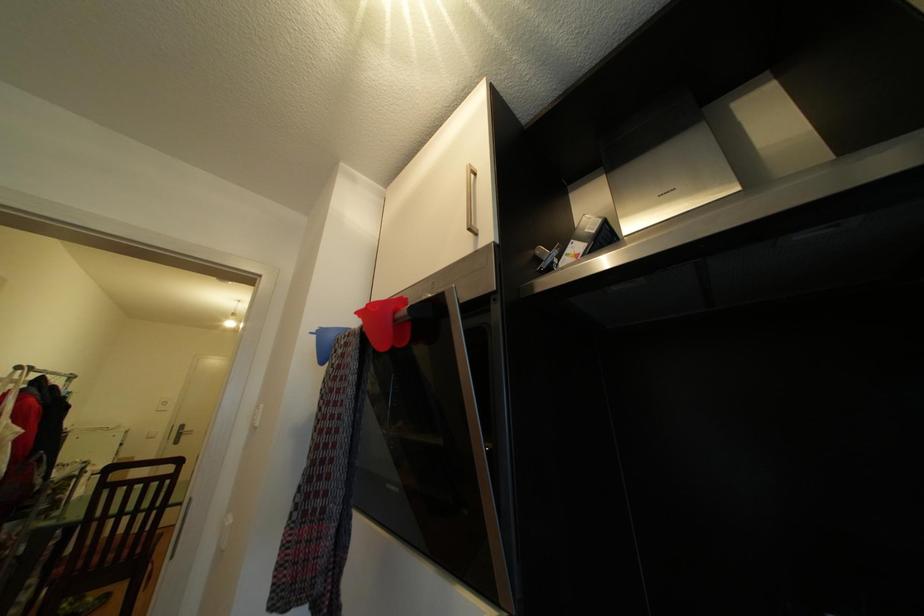
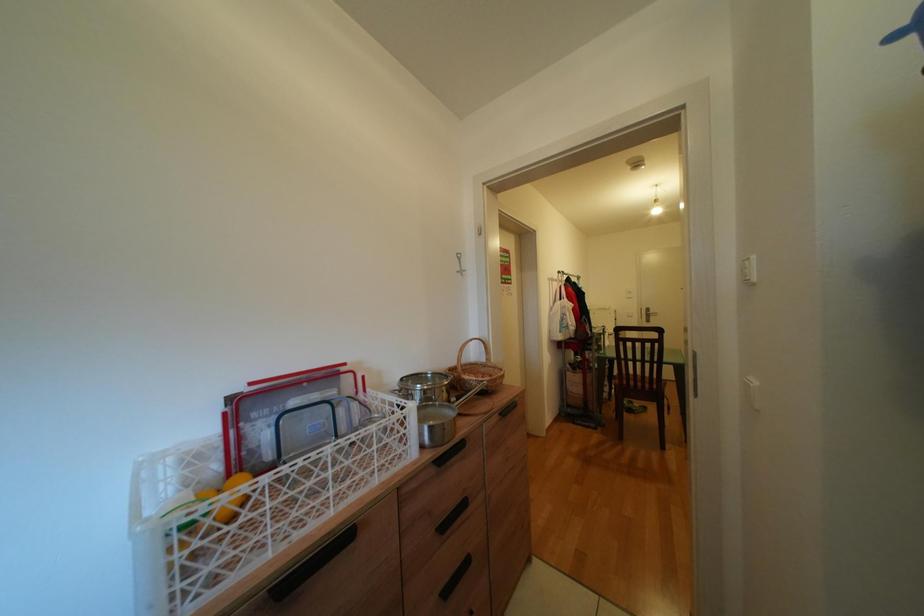
Question: The images are taken continuously from a first-person perspective. In which direction is your viewpoint rotating?

Choices:
 (A) Left
 (B) Right
 (C) Up
 (D) Down

Answer: (A)